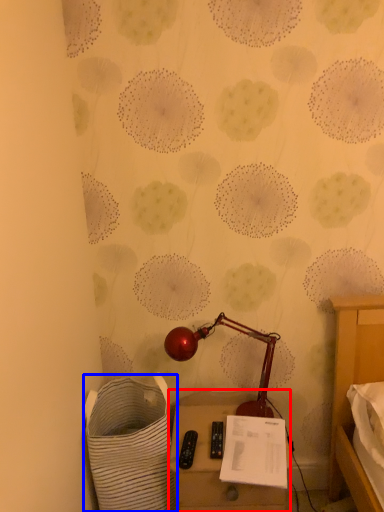
Question: Which object is closer to the camera taking this photo, furniture (highlighted by a red box) or laundry basket (highlighted by a blue box)?

Choices:
 (A) furniture
 (B) laundry basket

Answer: (B)